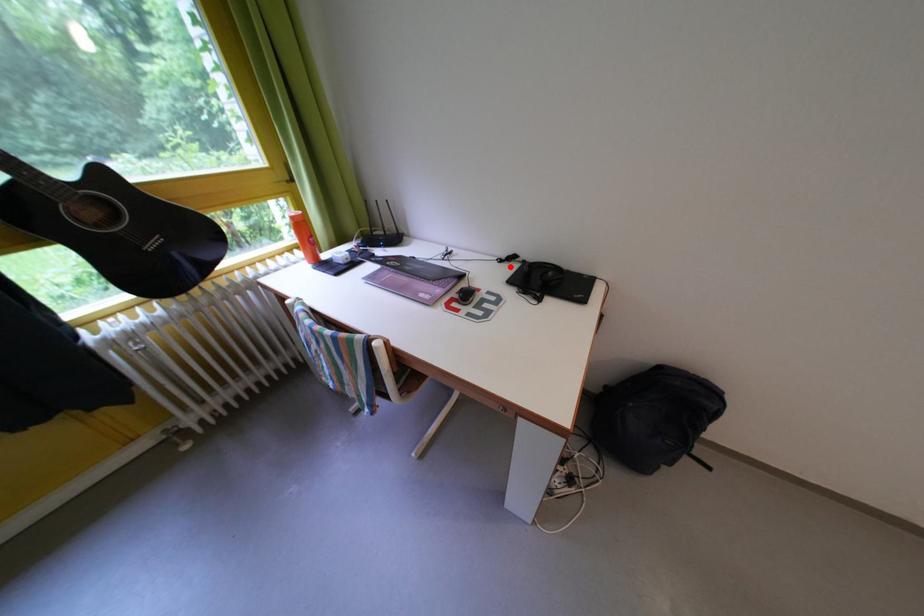
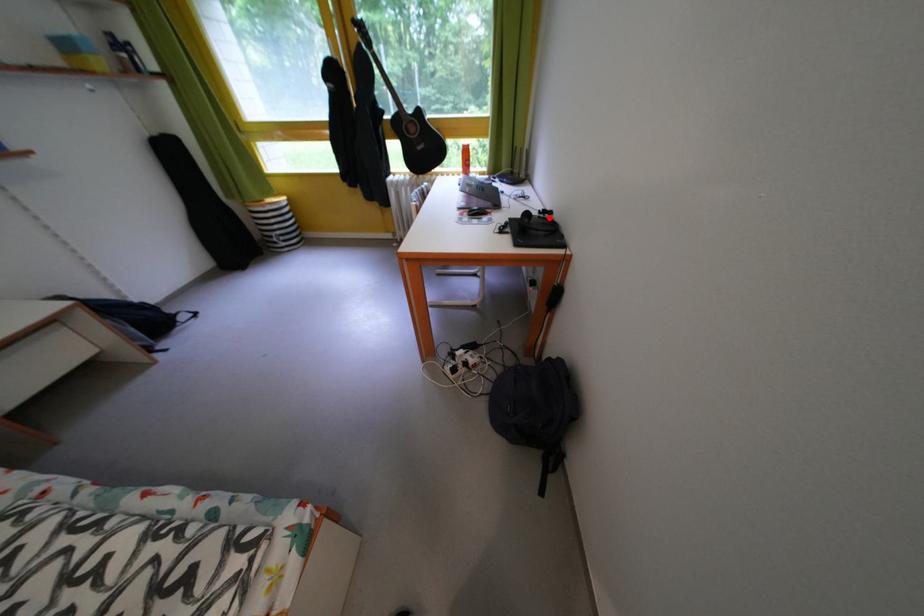
I am providing you with two images of the same scene from different viewpoints. A red point is marked on the first image and another point is marked on the second image. Does the point marked in image1 correspond to the same location as the one in image2?

Yes